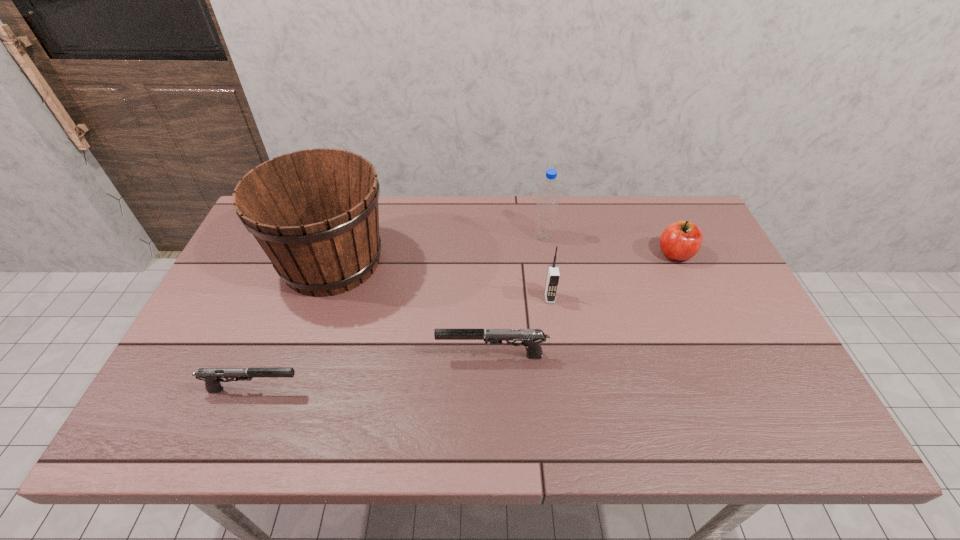
Choose which object is the nearest neighbor to the right gun. Please provide its 2D coordinates. Your answer should be formatted as a tuple, i.e. [(x, y)], where the tuple contains the x and y coordinates of a point satisfying the conditions above.

[(553, 275)]

The width and height of the screenshot is (960, 540). In order to click on free space that satisfies the following two spatial constraints: 1. on the front-facing side of the cellular telephone; 2. at the muzzle end of the nearer gun in this screenshot , I will do `click(563, 389)`.

Identify the location of vacant space that satisfies the following two spatial constraints: 1. on the front side of the water bottle; 2. at the muzzle end of the left gun. (566, 389).